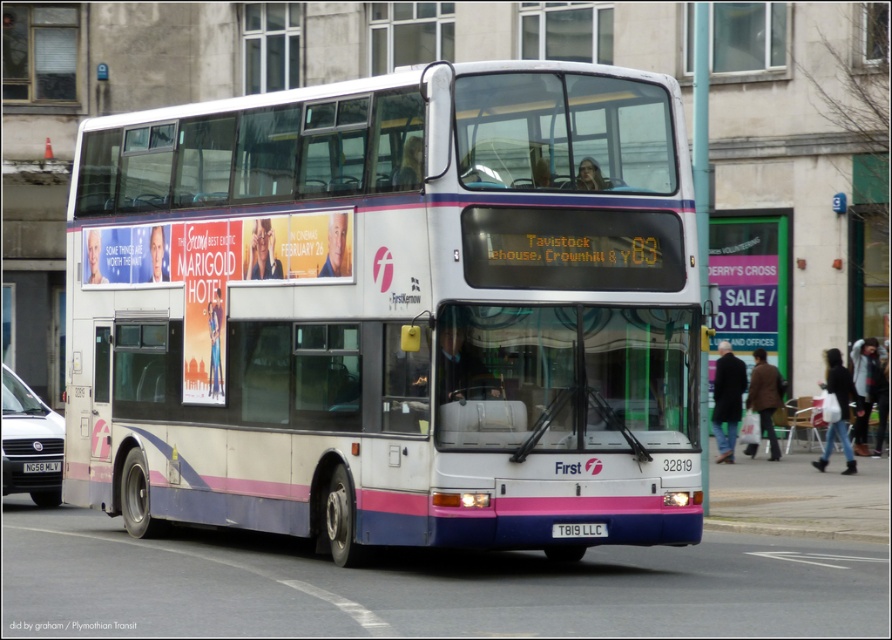
Question: Which of the following is the closest to the observer?

Choices:
 (A) white plastic license plate at center
 (B) black plastic license plate at center

Answer: (A)

Question: Can you confirm if white plastic license plate at center is bigger than black plastic license plate at center?

Choices:
 (A) yes
 (B) no

Answer: (B)

Question: Does white plastic license plate at center appear over black plastic license plate at center?

Choices:
 (A) yes
 (B) no

Answer: (A)

Question: Does white matte/deck bus at center have a larger size compared to black plastic license plate at center?

Choices:
 (A) no
 (B) yes

Answer: (B)

Question: Estimate the real-world distances between objects in this image. Which object is closer to the black plastic license plate at center?

Choices:
 (A) white plastic license plate at center
 (B) white matte/deck bus at center

Answer: (A)

Question: Which object is positioned farthest from the white matte/deck bus at center?

Choices:
 (A) black plastic license plate at center
 (B) white plastic license plate at center

Answer: (A)